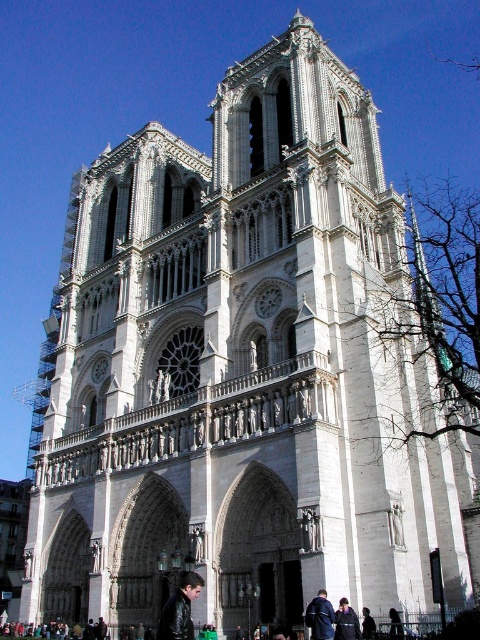
Based on the photo, you are standing in front of the Notre Dame Cathedral and see a dark blue leather jacket at lower center. Where exactly is the dark blue leather jacket located in relation to the cathedral?

The dark blue leather jacket at lower center is located at point 0.964 on the x axis and 0.667 on the y axis relative to the cathedral.

You are a fashion designer observing two leather jackets in an image of Notre Dame Cathedral. The jackets are labeled as the leather jacket at lower center and the dark brown leather jacket at lower right. Which jacket would require more fabric to produce?

The leather jacket at lower center would require more fabric to produce since it is bigger than the dark brown leather jacket at lower right.

You are standing in front of the Notre Dame Cathedral and notice a dark blue leather jacket at lower right. Where exactly is the dark blue leather jacket located in relation to the cathedral?

The dark blue leather jacket at lower right is located at point (346, 621) in the image.